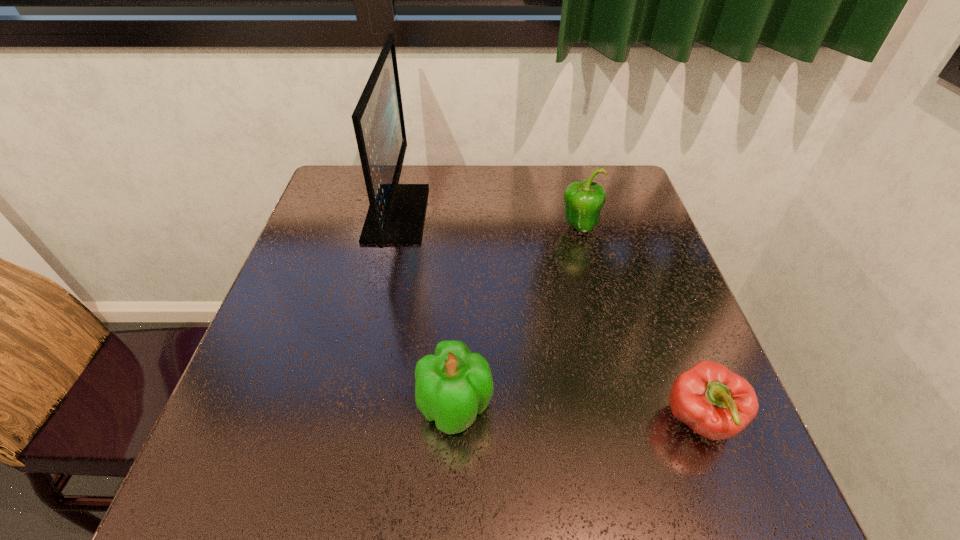
You are a GUI agent. You are given a task and a screenshot of the screen. Output one action in this format:
    pyautogui.click(x=<x>, y=<y>)
    Task: Click on the free space between the third object from left to right and the tallest object
    The height and width of the screenshot is (540, 960).
    Given the screenshot: What is the action you would take?
    pyautogui.click(x=489, y=220)

The width and height of the screenshot is (960, 540). Identify the location of free space between the shortest bell pepper and the leftmost object. (548, 317).

The width and height of the screenshot is (960, 540). What are the coordinates of `object that ranks as the closest to the shortest bell pepper` in the screenshot? It's located at (452, 386).

The image size is (960, 540). What are the coordinates of `object that can be found as the third closest to the leftmost bell pepper` in the screenshot? It's located at (583, 201).

Locate which bell pepper is the second closest to the rightmost bell pepper. Please provide its 2D coordinates. Your answer should be formatted as a tuple, i.e. [(x, y)], where the tuple contains the x and y coordinates of a point satisfying the conditions above.

[(583, 201)]

Identify which bell pepper is located as the nearest to the second object from right to left. Please provide its 2D coordinates. Your answer should be formatted as a tuple, i.e. [(x, y)], where the tuple contains the x and y coordinates of a point satisfying the conditions above.

[(716, 403)]

Image resolution: width=960 pixels, height=540 pixels. What are the coordinates of `free space that satisfies the following two spatial constraints: 1. on the screen side of the tallest object; 2. on the back side of the third object from right to left` in the screenshot? It's located at (354, 407).

Find the location of a particular element. The width and height of the screenshot is (960, 540). vacant region that satisfies the following two spatial constraints: 1. on the screen side of the shortest bell pepper; 2. on the right side of the tallest object is located at coordinates (351, 421).

You are a GUI agent. You are given a task and a screenshot of the screen. Output one action in this format:
    pyautogui.click(x=<x>, y=<y>)
    Task: Click on the free region that satisfies the following two spatial constraints: 1. on the screen side of the tallest object; 2. on the left side of the rightmost bell pepper
    The width and height of the screenshot is (960, 540).
    Given the screenshot: What is the action you would take?
    pyautogui.click(x=351, y=421)

At what (x,y) coordinates should I click in order to perform the action: click on vacant space that satisfies the following two spatial constraints: 1. on the screen side of the monitor; 2. on the back side of the third object from left to right. Please return your answer as a coordinate pair (x, y). Looking at the image, I should click on (394, 227).